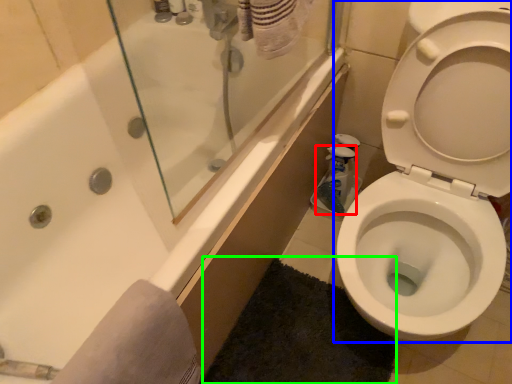
Question: Which object is the closest to the cleaning product (highlighted by a red box)? Choose among these: toilet (highlighted by a blue box) or bath mat (highlighted by a green box).

Choices:
 (A) toilet
 (B) bath mat

Answer: (A)